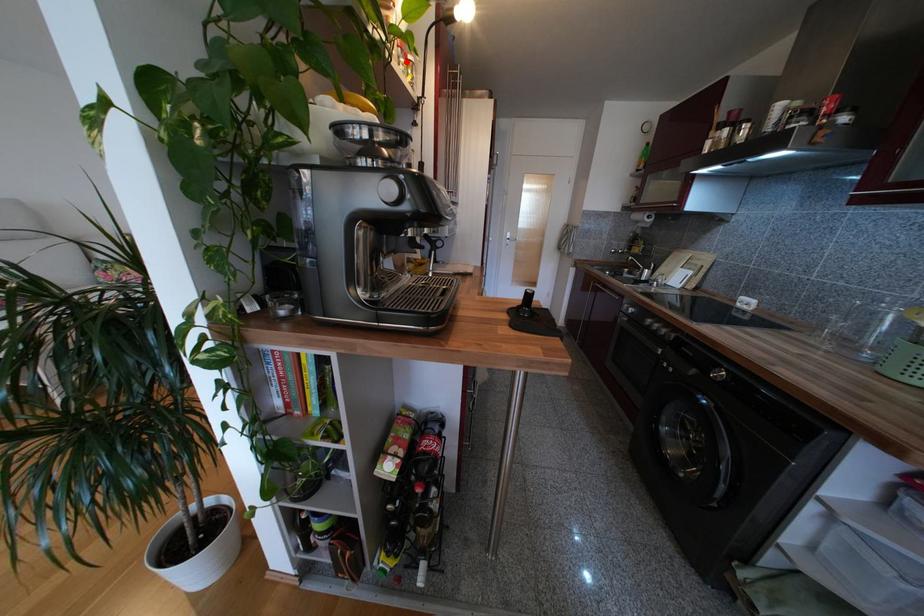
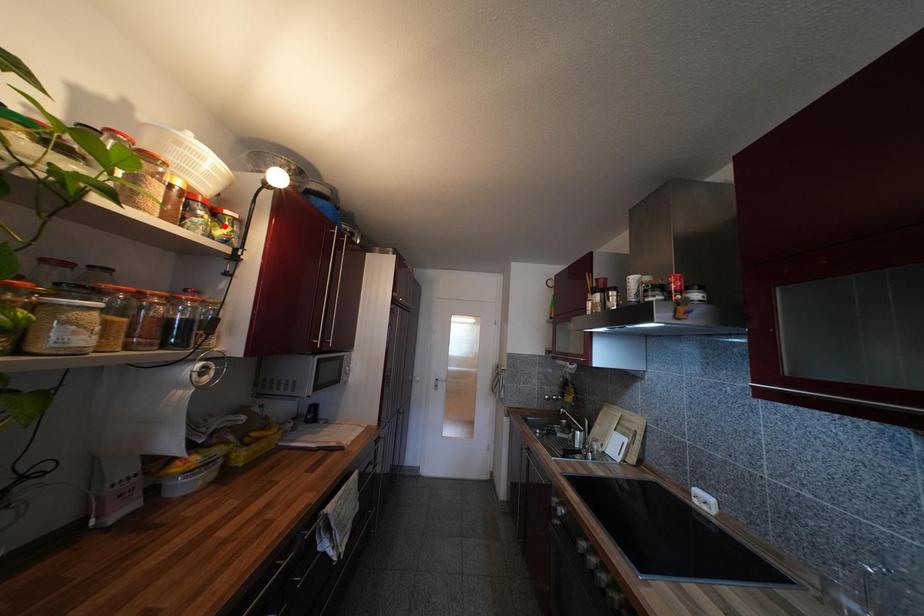
I am providing you with two images of the same scene from different viewpoints. A red point is marked on the first image and another point is marked on the second image. Do the highlighted points in image1 and image2 indicate the same real-world spot?

No